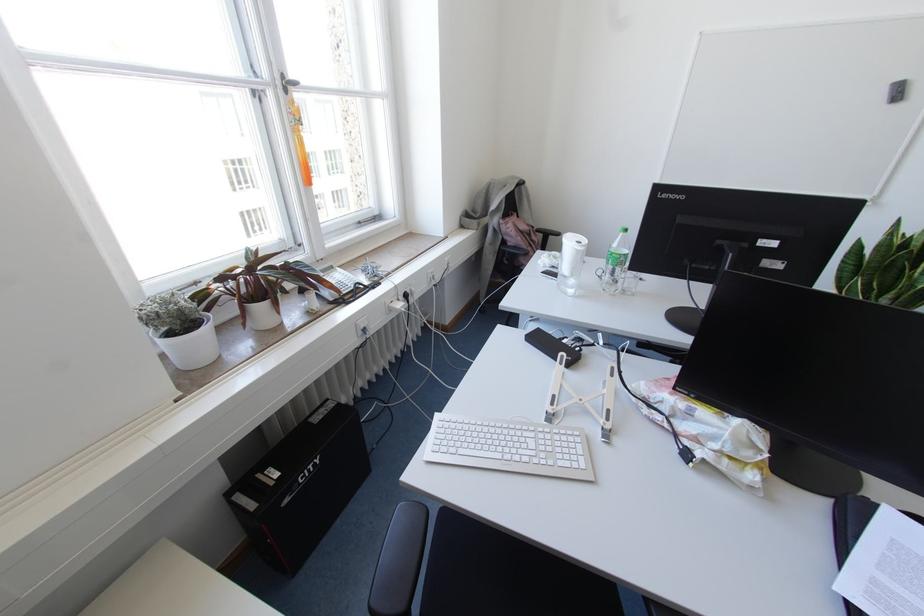
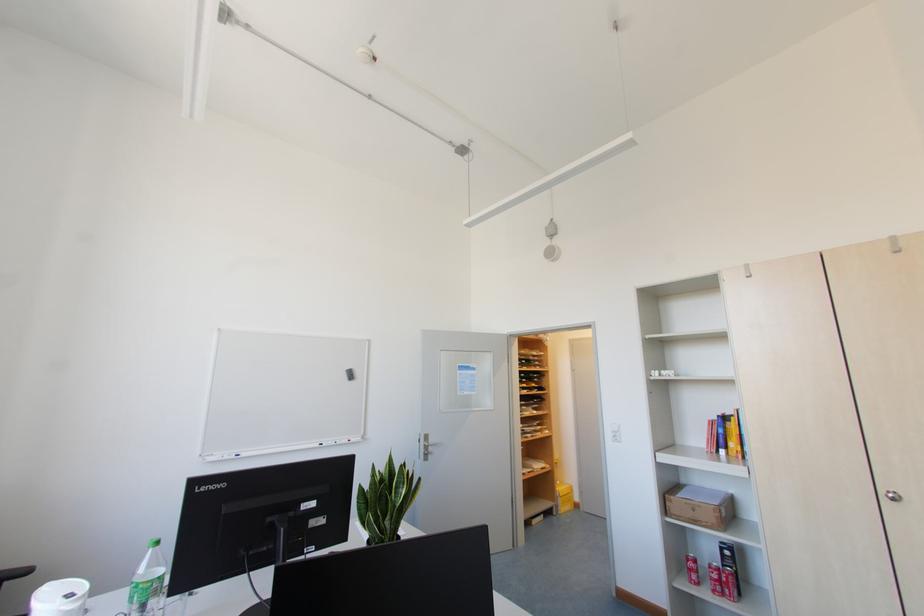
How did the camera likely rotate?

The rotation direction of the camera is right-up.